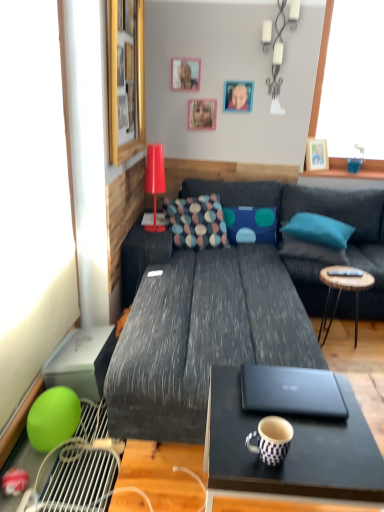
This screenshot has height=512, width=384. I want to click on free space behind blue and white checkered coffee cup at lower center, so [242, 413].